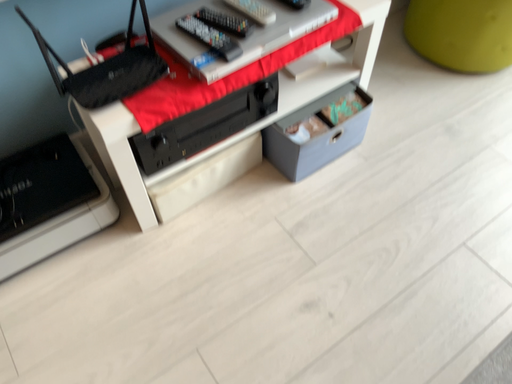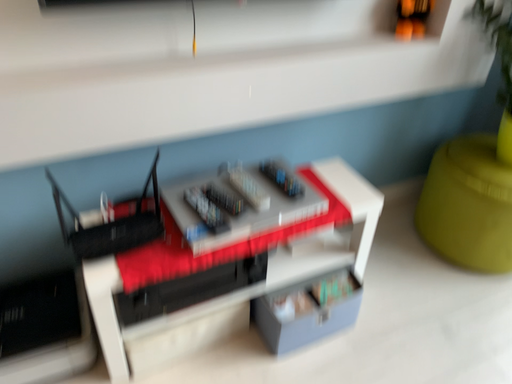
Question: How did the camera likely rotate when shooting the video?

Choices:
 (A) rotated upward
 (B) rotated downward

Answer: (A)